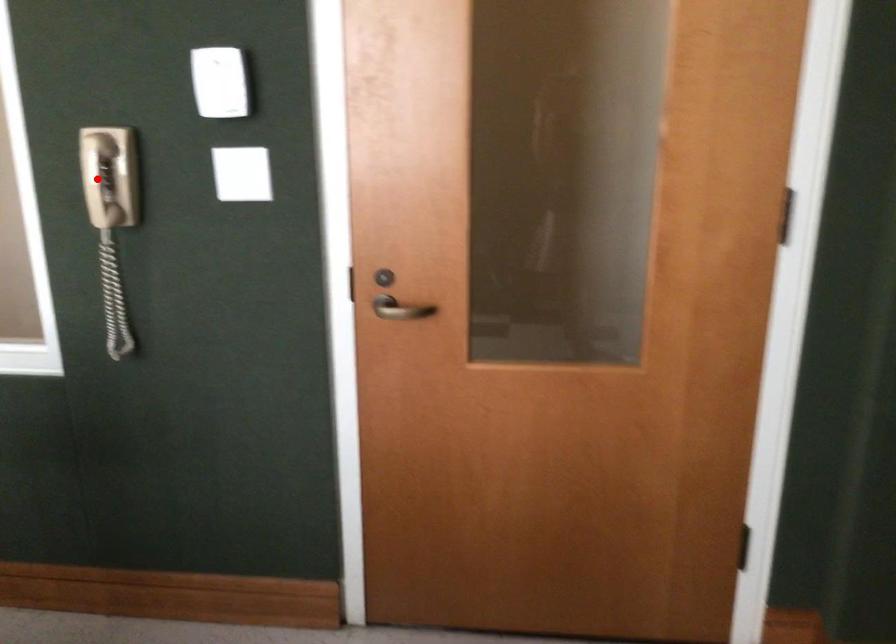
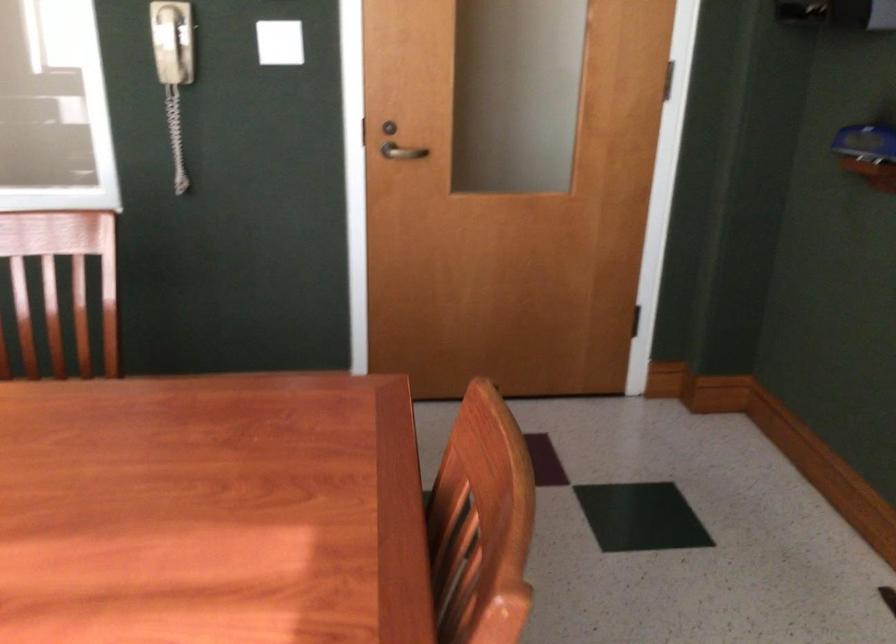
Question: I am providing you with two images of the same scene from different viewpoints. Image1 has a red point marked. In image2, the corresponding 3D location appears at what relative position? Reply with the corresponding letter.

Choices:
 (A) Closer
 (B) Farther

Answer: (B)